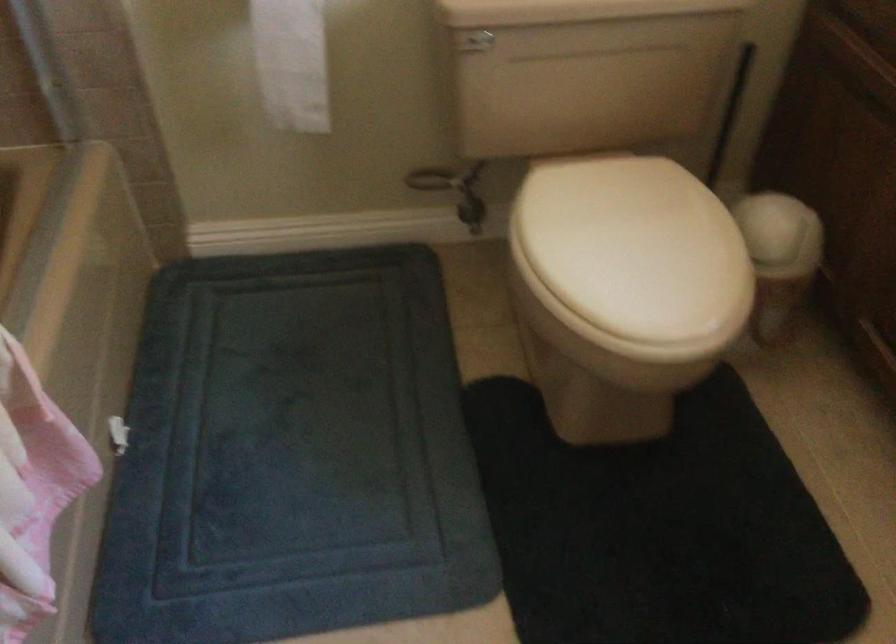
Where would you pull the toilet paper sheet? Please return your answer as a coordinate pair (x, y).

(291, 62)